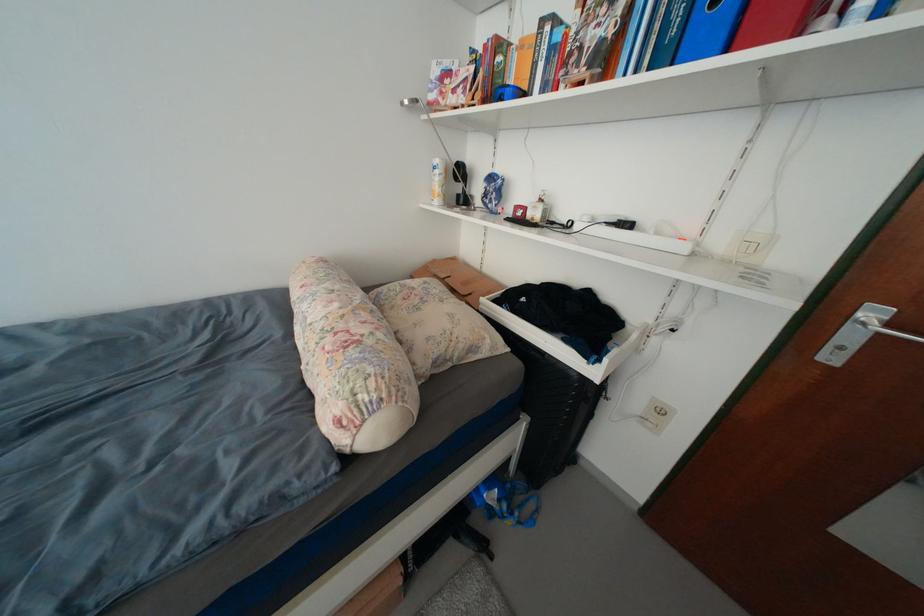
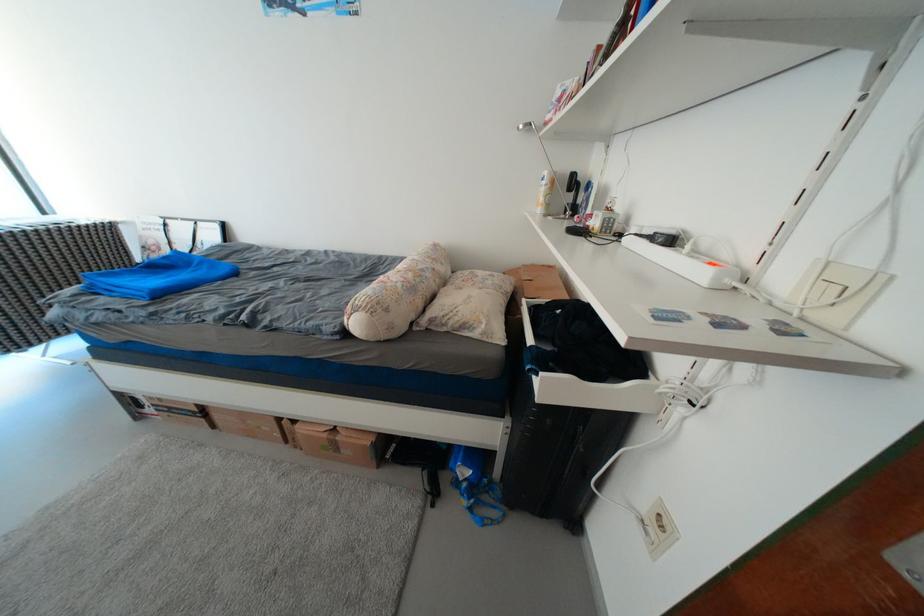
Find the pixel in the second image that matches (x=466, y=357) in the first image.

(459, 325)